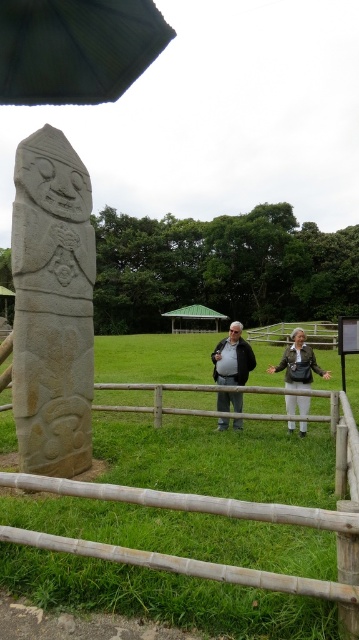
Does green fabric umbrella at upper left have a lesser height compared to wooden at center?

Yes.

Who is taller, green fabric umbrella at upper left or wooden at center?

wooden at center is taller.

You are a GUI agent. You are given a task and a screenshot of the screen. Output one action in this format:
    pyautogui.click(x=<x>, y=<y>)
    Task: Click on the green fabric umbrella at upper left
    
    Given the screenshot: What is the action you would take?
    pyautogui.click(x=76, y=49)

At what (x,y) coordinates should I click in order to perform the action: click on green fabric umbrella at upper left. Please return your answer as a coordinate pair (x, y). The width and height of the screenshot is (359, 640). Looking at the image, I should click on (76, 49).

Can you confirm if white stone carving at left is shorter than wooden at center?

Correct, white stone carving at left is not as tall as wooden at center.

Does white stone carving at left lie behind wooden at center?

No, white stone carving at left is in front of wooden at center.

Is point (39, 179) less distant than point (280, 342)?

Yes.

You are a GUI agent. You are given a task and a screenshot of the screen. Output one action in this format:
    pyautogui.click(x=<x>, y=<y>)
    Task: Click on the white stone carving at left
    
    Given the screenshot: What is the action you would take?
    pyautogui.click(x=52, y=305)

How far apart are white stone carving at left and green fabric umbrella at upper left?

They are 9.09 feet apart.

Does white stone carving at left have a smaller size compared to green fabric umbrella at upper left?

Yes, white stone carving at left is smaller than green fabric umbrella at upper left.

Which is behind, point (47, 154) or point (62, 19)?

Positioned behind is point (47, 154).

The height and width of the screenshot is (640, 359). I want to click on white stone carving at left, so click(52, 305).